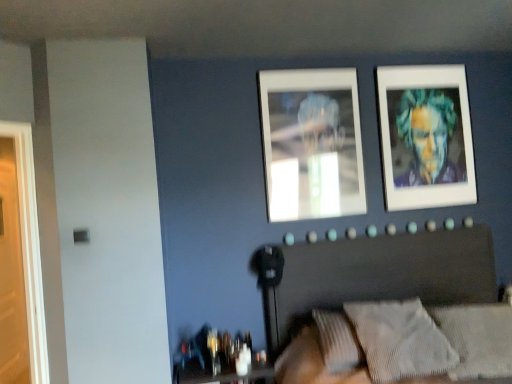
Question: From a real-world perspective, is translucent glass table at lower center located beneath textured gray headboard at center?

Choices:
 (A) no
 (B) yes

Answer: (B)

Question: Considering the relative sizes of translucent glass table at lower center and textured gray headboard at center in the image provided, is translucent glass table at lower center shorter than textured gray headboard at center?

Choices:
 (A) yes
 (B) no

Answer: (A)

Question: Is translucent glass table at lower center aimed at textured gray headboard at center?

Choices:
 (A) no
 (B) yes

Answer: (A)

Question: Can you confirm if translucent glass table at lower center is taller than textured gray headboard at center?

Choices:
 (A) yes
 (B) no

Answer: (B)

Question: Is translucent glass table at lower center bigger than textured gray headboard at center?

Choices:
 (A) yes
 (B) no

Answer: (B)

Question: From the image's perspective, is translucent glass table at lower center located above textured gray headboard at center?

Choices:
 (A) yes
 (B) no

Answer: (B)

Question: From the image's perspective, does textured gray pillow at lower right, the 2th pillow when ordered from right to left, appear lower than metallic silver portrait at upper right, which is counted as the first picture frame, starting from the back?

Choices:
 (A) no
 (B) yes

Answer: (B)

Question: Is textured gray pillow at lower right, the 2th pillow when ordered from right to left, completely or partially outside of metallic silver portrait at upper right, which is the first picture frame from right to left?

Choices:
 (A) no
 (B) yes

Answer: (B)

Question: Is textured gray pillow at lower right, arranged as the 1th pillow when viewed from the left, smaller than metallic silver portrait at upper right, which ranks as the second picture frame in left-to-right order?

Choices:
 (A) yes
 (B) no

Answer: (B)

Question: From a real-world perspective, is textured gray pillow at lower right, arranged as the 1th pillow when viewed from the left, located higher than metallic silver portrait at upper right, which is the first picture frame from right to left?

Choices:
 (A) yes
 (B) no

Answer: (B)

Question: Could you tell me if textured gray pillow at lower right, the 2th pillow when ordered from right to left, is turned towards metallic silver portrait at upper right, which ranks as the second picture frame in left-to-right order?

Choices:
 (A) no
 (B) yes

Answer: (A)

Question: Is textured gray pillow at lower right, the 2th pillow when ordered from right to left, turned away from metallic silver portrait at upper right, which ranks as the second picture frame in left-to-right order?

Choices:
 (A) yes
 (B) no

Answer: (B)

Question: Does textured gray headboard at center appear on the right side of textured gray pillow at lower right, marked as the 1th pillow in a right-to-left arrangement?

Choices:
 (A) no
 (B) yes

Answer: (A)